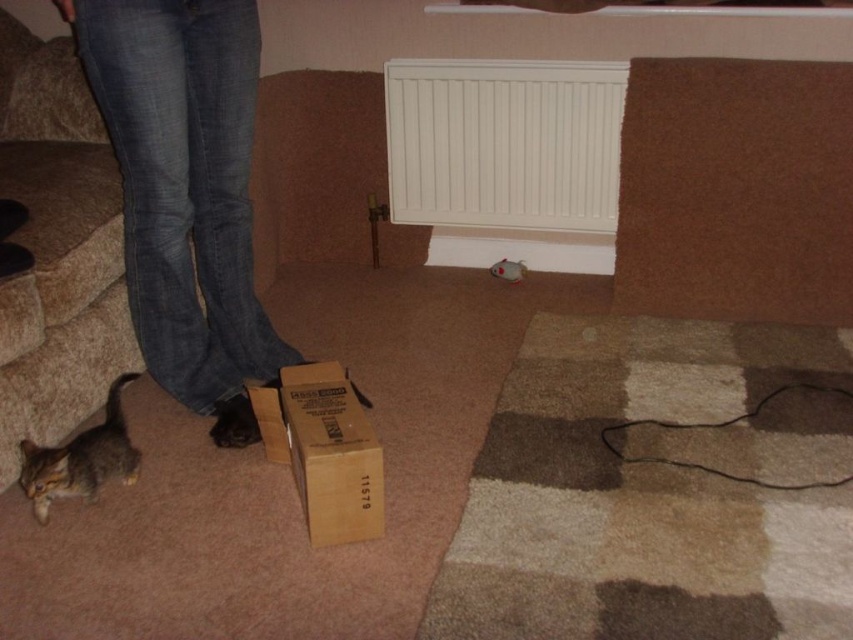
Who is more distant from viewer, [416,172] or [103,468]?

Point [416,172]

Where is `white matte radiator at center`? white matte radiator at center is located at coordinates (503, 144).

Find the location of a particular element. white matte radiator at center is located at coordinates (503, 144).

Can you confirm if denim jeans at lower left is taller than white matte radiator at center?

Indeed, denim jeans at lower left has a greater height compared to white matte radiator at center.

Between denim jeans at lower left and white matte radiator at center, which one has less height?

Standing shorter between the two is white matte radiator at center.

Describe the element at coordinates (186, 193) in the screenshot. The width and height of the screenshot is (853, 640). I see `denim jeans at lower left` at that location.

Identify the location of denim jeans at lower left. The width and height of the screenshot is (853, 640). (186, 193).

Is denim jeans at lower left behind brown cardboard box at lower center?

Yes, denim jeans at lower left is behind brown cardboard box at lower center.

Is point (219, 278) positioned after point (326, 435)?

Yes.

Between point (233, 234) and point (309, 433), which one is positioned behind?

Positioned behind is point (233, 234).

Locate an element on the screen. This screenshot has height=640, width=853. denim jeans at lower left is located at coordinates (186, 193).